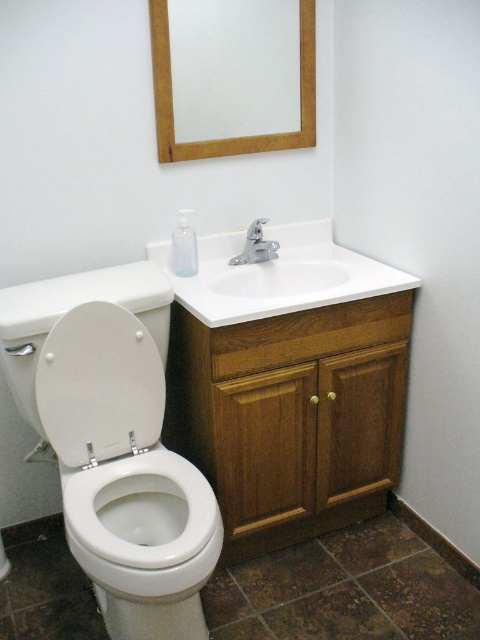
Question: In this image, where is white glossy toilet at left located relative to white glossy sink at center?

Choices:
 (A) below
 (B) above

Answer: (A)

Question: Can you confirm if white glossy toilet at left is smaller than white matte toilet lid at left?

Choices:
 (A) yes
 (B) no

Answer: (B)

Question: Which is nearer to the wooden frame at upper center?

Choices:
 (A) white matte toilet lid at left
 (B) silver metallic faucet at sink center

Answer: (B)

Question: Which point is closer to the camera taking this photo?

Choices:
 (A) (120, 499)
 (B) (417, 280)

Answer: (A)

Question: Is white glossy toilet at left bigger than silver metallic faucet at sink center?

Choices:
 (A) yes
 (B) no

Answer: (A)

Question: Estimate the real-world distances between objects in this image. Which object is farther from the white glossy sink at center?

Choices:
 (A) wooden frame at upper center
 (B) white glossy toilet at left

Answer: (A)